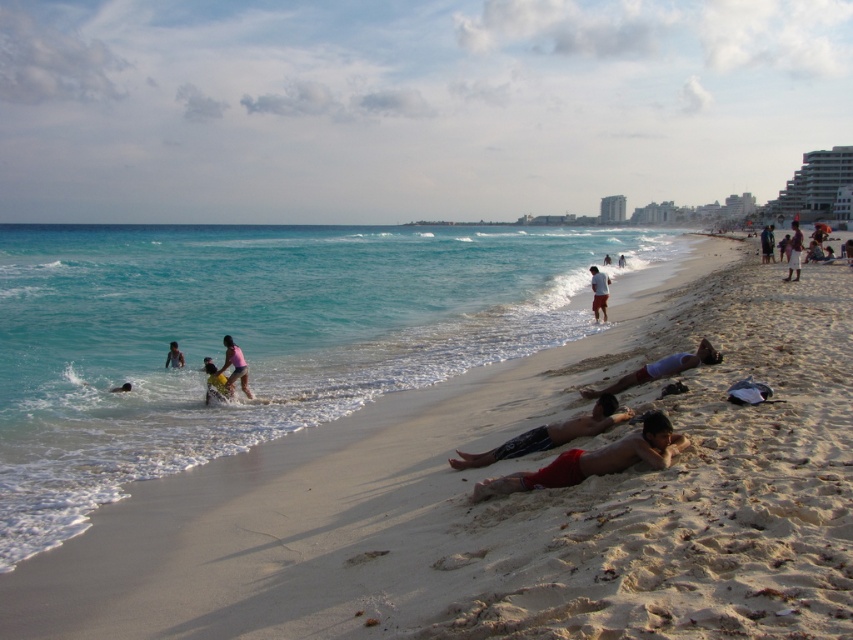
Who is taller, light blue fabric shorts at center or dark blue fabric at lower right?

Standing taller between the two is dark blue fabric at lower right.

Does light blue fabric shorts at center have a larger size compared to dark blue fabric at lower right?

No.

Where is `light blue fabric shorts at center`? The height and width of the screenshot is (640, 853). light blue fabric shorts at center is located at coordinates (660, 369).

The height and width of the screenshot is (640, 853). I want to click on light blue fabric shorts at center, so click(660, 369).

Does red fabric shorts at center have a lesser height compared to light brown skin at lower left?

In fact, red fabric shorts at center may be taller than light brown skin at lower left.

Which is below, red fabric shorts at center or light brown skin at lower left?

red fabric shorts at center is lower down.

Which is in front, point (548, 468) or point (165, 362)?

Point (548, 468) is in front.

I want to click on red fabric shorts at center, so click(x=595, y=460).

Is point (173, 364) less distant than point (610, 259)?

Yes, it is.

Where is `light brown skin at lower left`? light brown skin at lower left is located at coordinates (173, 356).